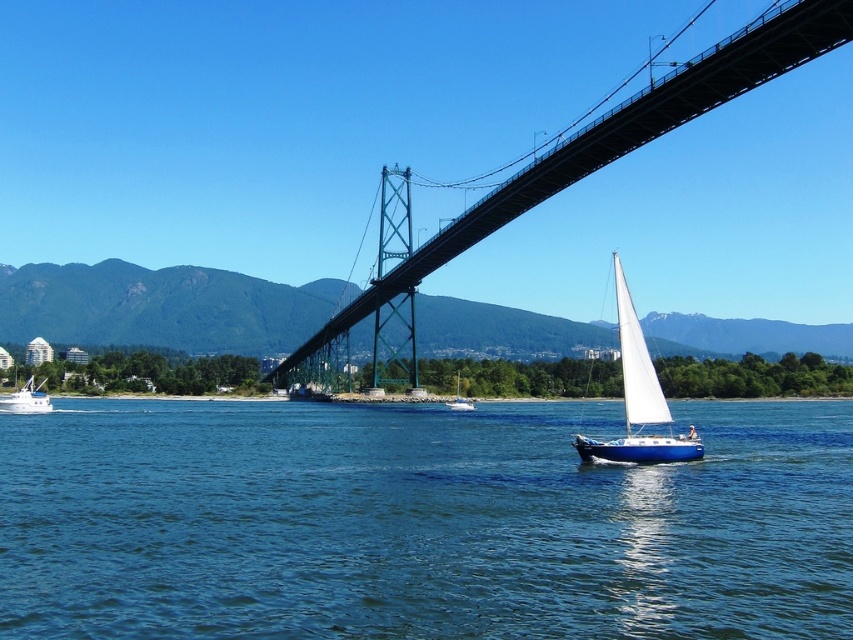
Question: Among these objects, which one is farthest from the camera?

Choices:
 (A) green metallic bridge at upper center
 (B) white sailboat at lower right
 (C) blue water at lower center

Answer: (A)

Question: Estimate the real-world distances between objects in this image. Which object is closer to the white sailboat at lower right?

Choices:
 (A) white plastic boat at lower left
 (B) white sailboat at center

Answer: (B)

Question: In this image, where is blue water at lower center located relative to white plastic boat at lower left?

Choices:
 (A) right
 (B) left

Answer: (A)

Question: Does blue water at lower center have a greater width compared to white sailboat at lower right?

Choices:
 (A) yes
 (B) no

Answer: (A)

Question: Is white sailboat at lower right positioned behind white plastic boat at lower left?

Choices:
 (A) no
 (B) yes

Answer: (A)

Question: Estimate the real-world distances between objects in this image. Which object is farther from the white sailboat at center?

Choices:
 (A) green metallic bridge at upper center
 (B) white sailboat at lower right
 (C) white plastic boat at lower left
 (D) blue water at lower center

Answer: (B)